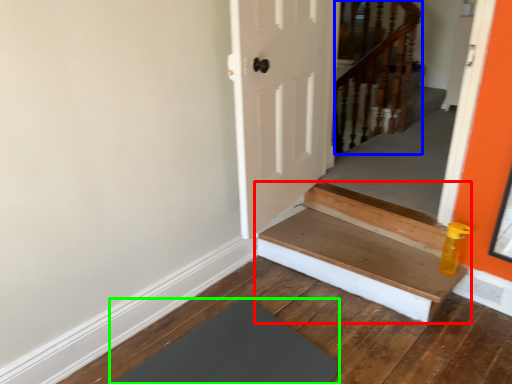
Question: Based on their relative distances, which object is farther from stairs (highlighted by a red box)? Choose from rail (highlighted by a blue box) and mat (highlighted by a green box).

Choices:
 (A) rail
 (B) mat

Answer: (A)